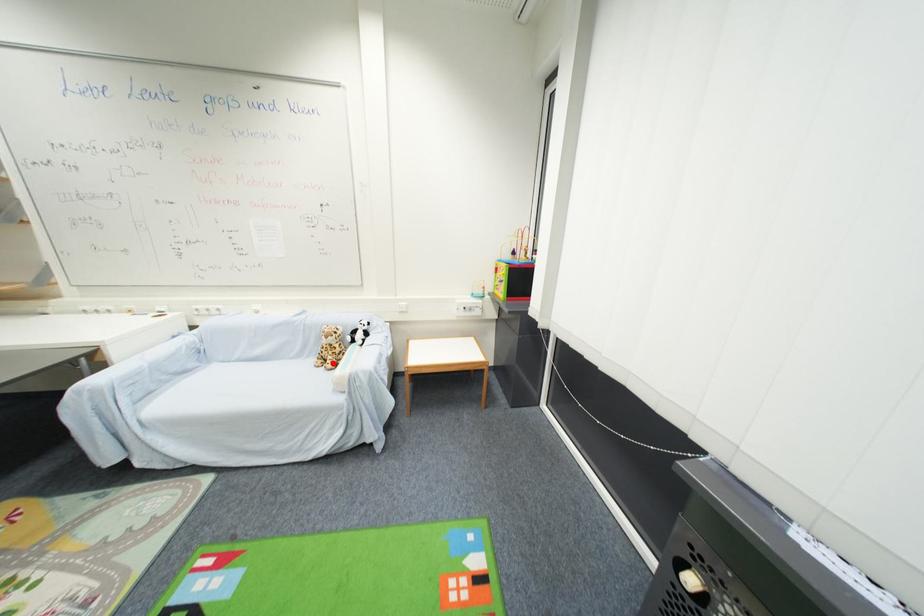
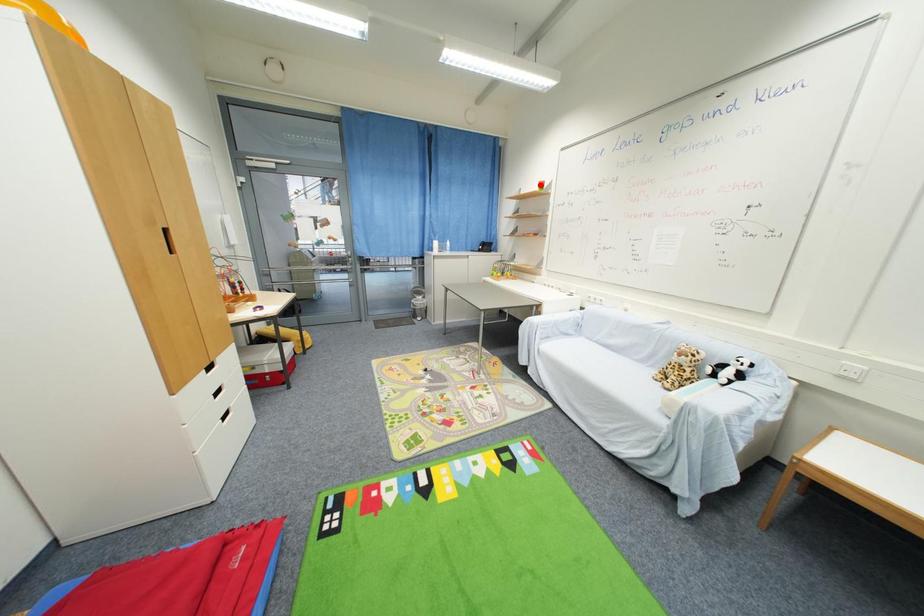
In the scene shown: I am providing you with two images of the same scene from different viewpoints. A red point is marked on the first image and another point is marked on the second image. Are the points marked in image1 and image2 representing the same 3D position?

No